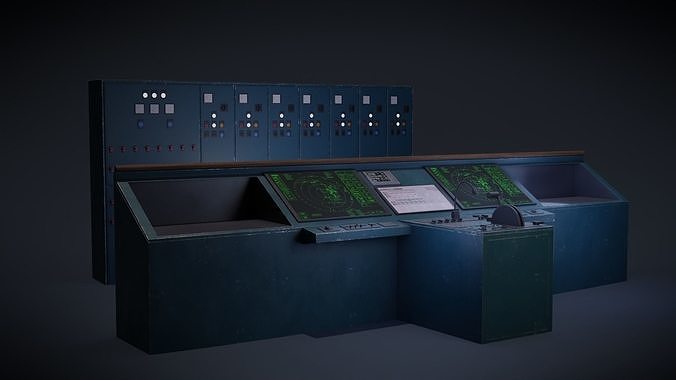
Locate an element on the screen. right side of desk is located at coordinates (602, 186).